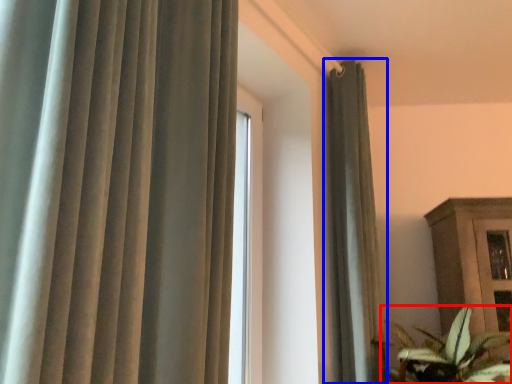
Question: Which object is closer to the camera taking this photo, houseplant (highlighted by a red box) or curtain (highlighted by a blue box)?

Choices:
 (A) houseplant
 (B) curtain

Answer: (A)